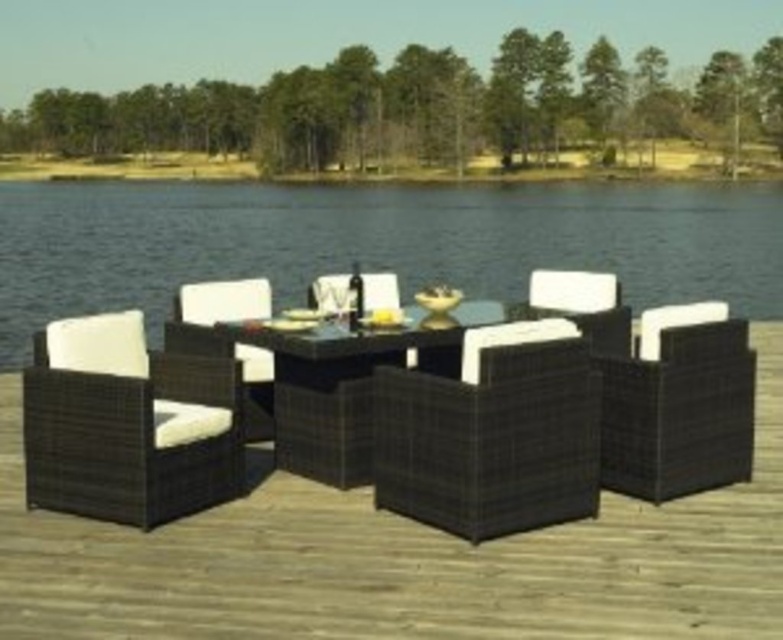
Question: Does blue water at center appear on the right side of white woven armchair at center?

Choices:
 (A) yes
 (B) no

Answer: (B)

Question: Is blue water at center to the right of matte wicker armchair at left from the viewer's perspective?

Choices:
 (A) yes
 (B) no

Answer: (B)

Question: Which object is closer to the camera taking this photo?

Choices:
 (A) blue water at center
 (B) black wicker table at center
 (C) black wicker furniture at center
 (D) black wicker armchair at right

Answer: (C)

Question: Based on their relative distances, which object is nearer to the blue water at center?

Choices:
 (A) black wicker armchair at center
 (B) black wicker armchair at left
 (C) black wicker table at center
 (D) black wicker furniture at center

Answer: (A)

Question: Which point is closer to the camera?

Choices:
 (A) (630, 518)
 (B) (314, 371)

Answer: (A)

Question: Is black wicker armchair at right positioned at the back of black wicker table at center?

Choices:
 (A) no
 (B) yes

Answer: (A)